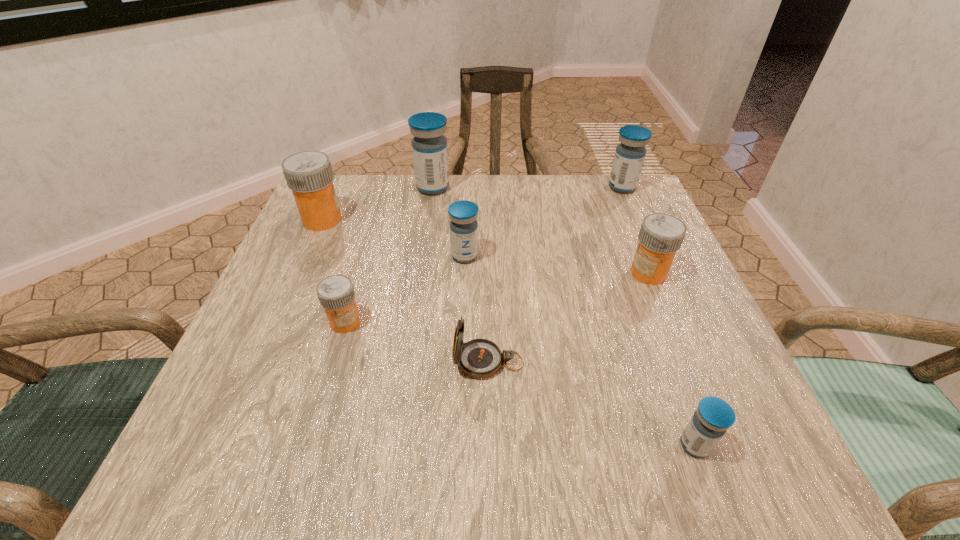
Image resolution: width=960 pixels, height=540 pixels. Identify the location of blue medicine that stands as the closest to the nearest blue medicine. (x=463, y=225).

Find the location of a particular element. orange medicine that stands as the second closest to the leftmost orange medicine is located at coordinates [661, 235].

What are the coordinates of `orange medicine that is the nearest to the second smallest orange medicine` in the screenshot? It's located at (336, 294).

Locate an element on the screen. free space that satisfies the following two spatial constraints: 1. on the label side of the second smallest blue medicine; 2. on the left side of the farthest orange medicine is located at coordinates (306, 256).

Locate an element on the screen. The height and width of the screenshot is (540, 960). free space that satisfies the following two spatial constraints: 1. on the face of the compass; 2. on the right side of the nearest object is located at coordinates (490, 445).